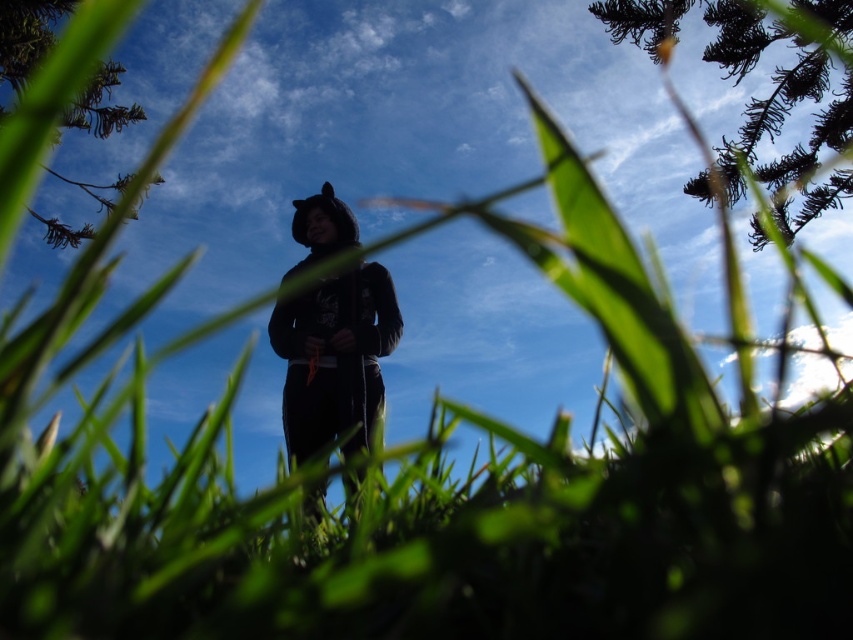
Question: Can you confirm if black matte hoodie at center is positioned above green leafy tree at upper left?

Choices:
 (A) yes
 (B) no

Answer: (B)

Question: Among these points, which one is nearest to the camera?

Choices:
 (A) (844, 147)
 (B) (308, 312)
 (C) (57, 243)

Answer: (B)

Question: Which of the following is the farthest from the observer?

Choices:
 (A) click(340, 298)
 (B) click(114, 113)
 (C) click(672, 1)

Answer: (B)

Question: Does dark green textured pine branch at upper right appear under black matte hoodie at center?

Choices:
 (A) yes
 (B) no

Answer: (B)

Question: Which of the following is the farthest from the observer?

Choices:
 (A) black matte hoodie at center
 (B) dark green textured pine branch at upper right
 (C) green leafy tree at upper left

Answer: (B)

Question: Can you confirm if dark green textured pine branch at upper right is bigger than green leafy tree at upper left?

Choices:
 (A) no
 (B) yes

Answer: (B)